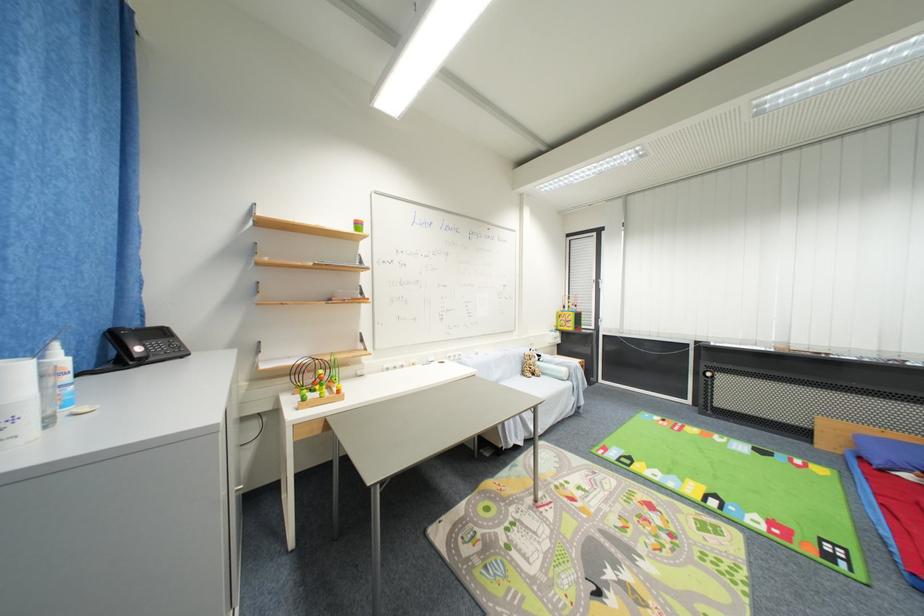
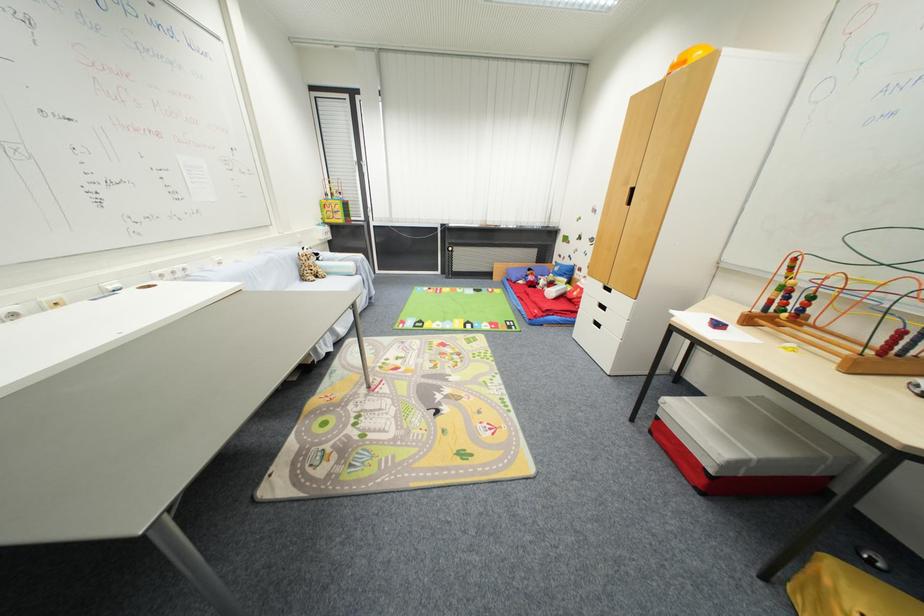
Find the pixel in the second image that matches the point at 525,371 in the first image.

(300, 276)